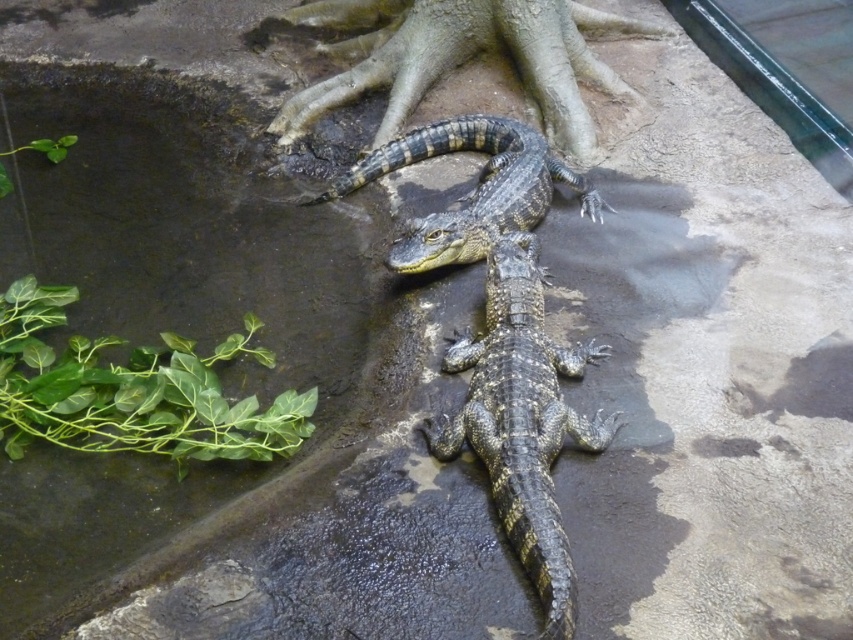
You are a zookeeper who needs to separate two crocodiles. You have a divider that is 5 inches wide. Can you place the divider between the shiny black crocodile at center and the shiny dark green crocodile at center to separate them?

The distance between the shiny black crocodile at center and the shiny dark green crocodile at center is 5.70 inches. Since the divider is 5 inches wide, it can fit between them as it is narrower than the space available.

You are a zookeeper observing two crocodiles in their enclosure. You notice a shiny black crocodile at center and a shiny dark green crocodile at center. Which one is located to the left of the other?

The shiny black crocodile at center is positioned on the left side of the shiny dark green crocodile at center.

You are a zookeeper who needs to locate the shiny black crocodile at center in the enclosure. According to the coordinates provided, where exactly is the crocodile positioned in the enclosure?

The shiny black crocodile at center is positioned at the coordinates point [502,332] in the enclosure.